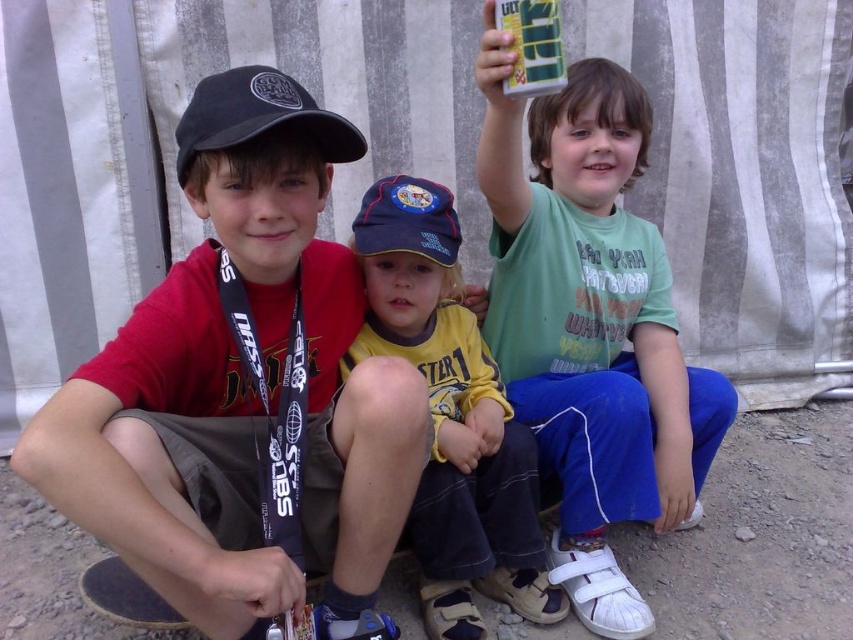
Question: Can you confirm if matte black cap at left is positioned below yellow jersey at center?

Choices:
 (A) no
 (B) yes

Answer: (A)

Question: Does matte black cap at left lie in front of yellow jersey at center?

Choices:
 (A) yes
 (B) no

Answer: (A)

Question: Among these objects, which one is farthest from the camera?

Choices:
 (A) black fabric baseball cap at left
 (B) matte black cap at left
 (C) green cotton shirt at center

Answer: (C)

Question: Does matte black cap at left have a smaller size compared to green cotton shirt at center?

Choices:
 (A) no
 (B) yes

Answer: (B)

Question: Which point is farther from the camera taking this photo?

Choices:
 (A) (279, 92)
 (B) (471, 323)
 (C) (595, 481)
 (D) (166, 396)

Answer: (B)

Question: Which point appears closest to the camera in this image?

Choices:
 (A) (436, 392)
 (B) (506, 74)

Answer: (B)